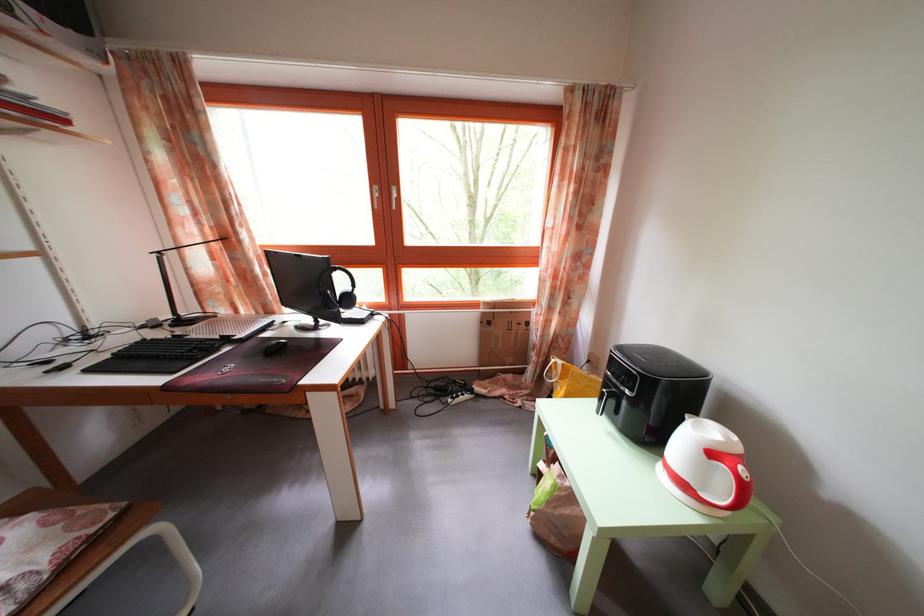
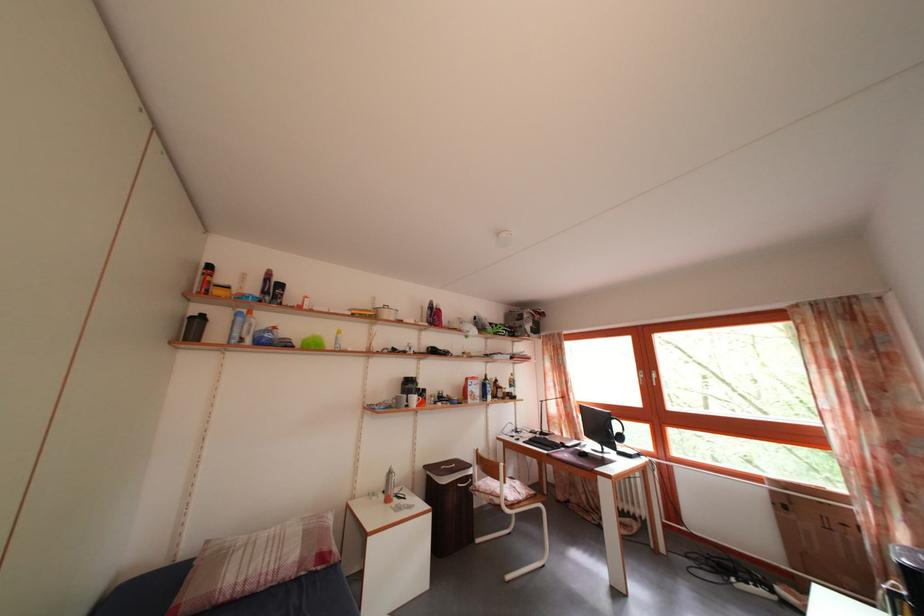
In the second image, find the point that corresponds to pixel 187 329 in the first image.

(550, 440)